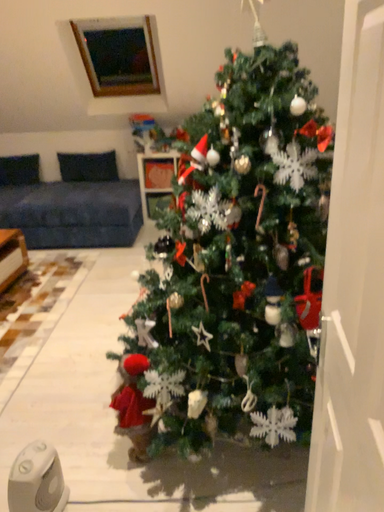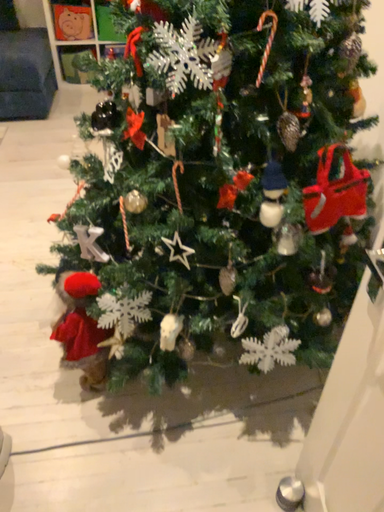
Question: Which way did the camera rotate in the video?

Choices:
 (A) rotated left
 (B) rotated right

Answer: (B)